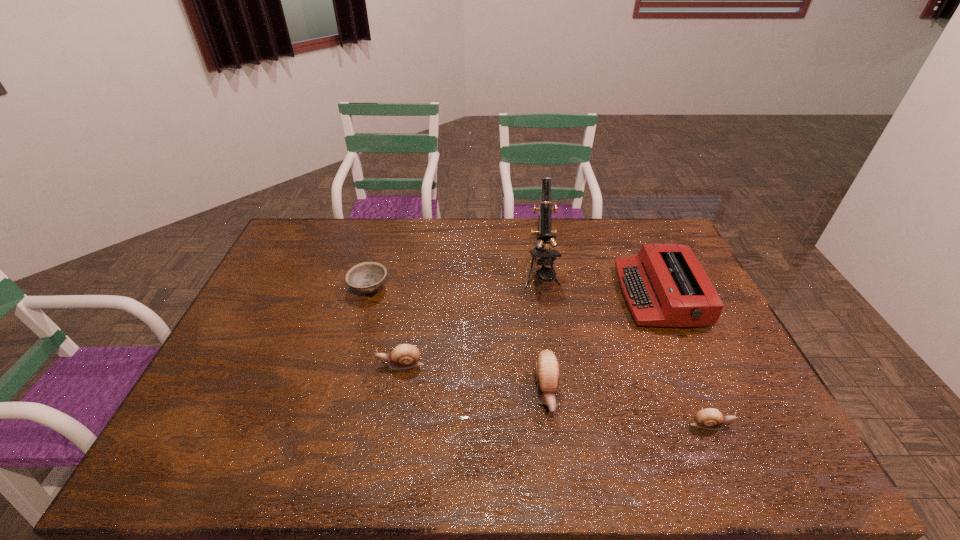
Locate an element on the screen. Image resolution: width=960 pixels, height=540 pixels. vacant space at the far edge of the desktop is located at coordinates (419, 227).

You are a GUI agent. You are given a task and a screenshot of the screen. Output one action in this format:
    pyautogui.click(x=<x>, y=<y>)
    Task: Click on the vacant space at the near edge
    This screenshot has width=960, height=540.
    Given the screenshot: What is the action you would take?
    pyautogui.click(x=420, y=416)

Identify the location of vacant space at the left edge of the desktop. This screenshot has width=960, height=540. (225, 377).

Find the location of a particular element. free location at the right edge is located at coordinates (692, 355).

Identify the location of vacant space at the far left corner. (285, 254).

Where is `vacant region between the bowl and the second escargot from right to left`? Image resolution: width=960 pixels, height=540 pixels. vacant region between the bowl and the second escargot from right to left is located at coordinates (x=458, y=341).

Identify the location of free space between the tallest object and the second escargot from left to right. (543, 334).

I want to click on free space between the microscope and the second escargot from right to left, so click(x=543, y=334).

At what (x,y) coordinates should I click in order to perform the action: click on free space between the microscope and the shortest escargot. Please return your answer as a coordinate pair (x, y). Looking at the image, I should click on (626, 350).

You are a GUI agent. You are given a task and a screenshot of the screen. Output one action in this format:
    pyautogui.click(x=<x>, y=<y>)
    Task: Click on the vacant area between the second escargot from left to right and the microscope
    This screenshot has width=960, height=540.
    Given the screenshot: What is the action you would take?
    pyautogui.click(x=543, y=334)